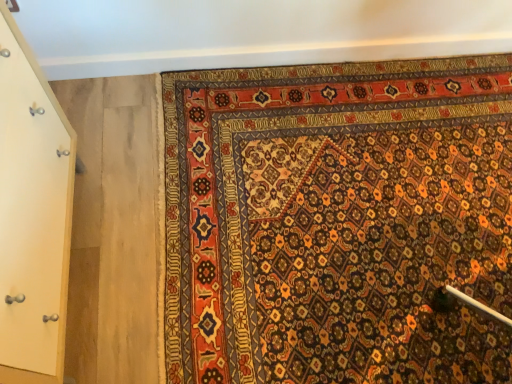
In order to click on free point to the right of light wood door at left in this screenshot , I will do `click(123, 286)`.